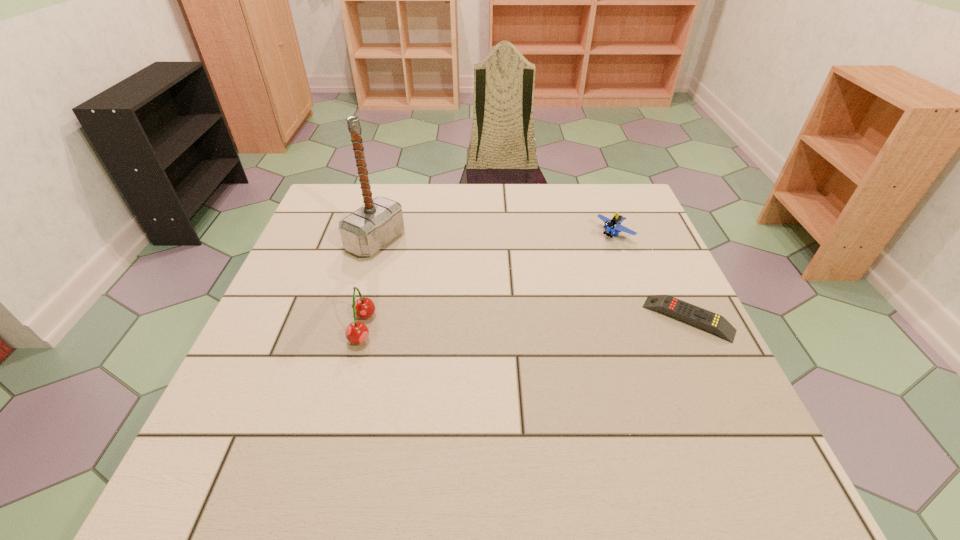
Where is `the second tallest object`? Image resolution: width=960 pixels, height=540 pixels. the second tallest object is located at coordinates (357, 332).

Where is `remote control`? Image resolution: width=960 pixels, height=540 pixels. remote control is located at coordinates (700, 317).

I want to click on hammer, so click(x=365, y=231).

Find the location of a particular element. This screenshot has width=960, height=540. the second shortest object is located at coordinates (612, 225).

Find the location of `vacant space situated 0.090m with stems pointing upwards on the cherry`. vacant space situated 0.090m with stems pointing upwards on the cherry is located at coordinates (308, 328).

Find the location of a particular element. vacant space located on the back of the shortest object is located at coordinates (647, 232).

Identify the location of free space located 0.330m on the striking surface of the tallest object. (508, 300).

At what (x,y) coordinates should I click in order to perform the action: click on vacant space located on the striking surface of the tallest object. Please return your answer as a coordinate pair (x, y). This screenshot has height=540, width=960. Looking at the image, I should click on (457, 278).

Where is `free region located 0.170m on the striking surface of the tallest object`? The width and height of the screenshot is (960, 540). free region located 0.170m on the striking surface of the tallest object is located at coordinates (450, 275).

Where is `blank space located 0.400m on the front-facing side of the second shortest object`? Image resolution: width=960 pixels, height=540 pixels. blank space located 0.400m on the front-facing side of the second shortest object is located at coordinates (495, 315).